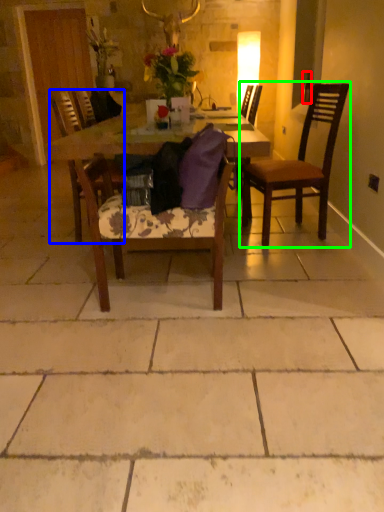
Question: Estimate the real-world distances between objects in this image. Which object is farther from bottle (highlighted by a red box), chair (highlighted by a blue box) or chair (highlighted by a green box)?

Choices:
 (A) chair
 (B) chair

Answer: (A)